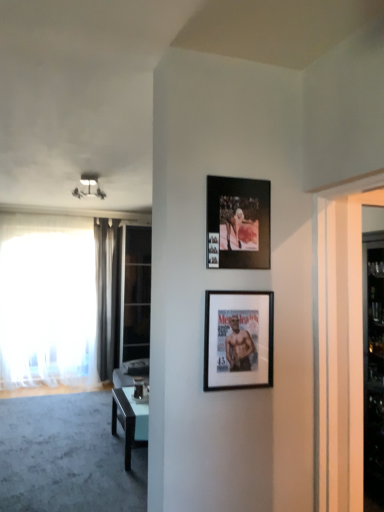
This screenshot has width=384, height=512. What do you see at coordinates (339, 351) in the screenshot? I see `white glass door at right` at bounding box center [339, 351].

Based on the photo, how much space does white sheer curtain at left, acting as the second curtain starting from the right, occupy horizontally?

white sheer curtain at left, acting as the second curtain starting from the right, is 7.44 inches wide.

The image size is (384, 512). Find the location of `black matte picture frame at center, arranged as the second picture frame when viewed from the top`. black matte picture frame at center, arranged as the second picture frame when viewed from the top is located at coordinates (238, 340).

In order to click on transparent glass door at left in this screenshot , I will do `click(135, 293)`.

Which object is thinner, white glass door at right or matte white light fixture at upper left?

With smaller width is white glass door at right.

Which point is more forward, (318, 321) or (83, 195)?

The point (318, 321) is closer to the camera.

Would you say white glass door at right is outside matte white light fixture at upper left?

That's correct, white glass door at right is outside of matte white light fixture at upper left.

Is transparent glass door at left positioned before white glass door at right?

No, it is behind white glass door at right.

From the image's perspective, relative to white glass door at right, is transparent glass door at left above or below?

Based on their image positions, transparent glass door at left is located beneath white glass door at right.

From a real-world perspective, is transparent glass door at left located higher than white glass door at right?

No, from a real-world perspective, transparent glass door at left is not over white glass door at right

Is black matte picture frame at upper center, which is the first picture frame in top-to-bottom order, looking in the opposite direction of white sheer curtain at left, the first curtain in the left-to-right sequence?

Yes.

Between black matte picture frame at upper center, which is the first picture frame in top-to-bottom order, and white sheer curtain at left, the first curtain in the left-to-right sequence, which one is positioned behind?

white sheer curtain at left, the first curtain in the left-to-right sequence, is further away from the camera.

Considering the relative positions of black matte picture frame at upper center, which is the first picture frame in top-to-bottom order, and white sheer curtain at left, the first curtain in the left-to-right sequence, in the image provided, is black matte picture frame at upper center, which is the first picture frame in top-to-bottom order, to the left or to the right of white sheer curtain at left, the first curtain in the left-to-right sequence,?

In the image, black matte picture frame at upper center, which is the first picture frame in top-to-bottom order, appears on the right side of white sheer curtain at left, the first curtain in the left-to-right sequence.

From the image's perspective, is black matte picture frame at upper center, which is the first picture frame in top-to-bottom order, located above or below white sheer curtain at left, the first curtain in the left-to-right sequence?

black matte picture frame at upper center, which is the first picture frame in top-to-bottom order, is situated higher than white sheer curtain at left, the first curtain in the left-to-right sequence, in the image.

Is black matte picture frame at upper center, which appears as the 2th picture frame when ordered from the bottom, further to camera compared to silky gray curtain at left, marked as the second curtain in a left-to-right arrangement?

That is False.

Considering the points (229, 209) and (99, 250), which point is in front, point (229, 209) or point (99, 250)?

The point (229, 209) is closer to the camera.

From the image's perspective, between black matte picture frame at upper center, which appears as the 2th picture frame when ordered from the bottom, and silky gray curtain at left, marked as the second curtain in a left-to-right arrangement, who is located below?

silky gray curtain at left, marked as the second curtain in a left-to-right arrangement, appears lower in the image.

Considering the positions of objects black matte picture frame at upper center, which appears as the 2th picture frame when ordered from the bottom, and silky gray curtain at left, which is counted as the 1th curtain, starting from the right, in the image provided, who is more to the left, black matte picture frame at upper center, which appears as the 2th picture frame when ordered from the bottom, or silky gray curtain at left, which is counted as the 1th curtain, starting from the right,?

Positioned to the left is silky gray curtain at left, which is counted as the 1th curtain, starting from the right.

Which is correct: silky gray curtain at left, which is counted as the 1th curtain, starting from the right, is inside white sheer curtain at left, the first curtain in the left-to-right sequence, or outside of it?

silky gray curtain at left, which is counted as the 1th curtain, starting from the right, is spatially situated outside white sheer curtain at left, the first curtain in the left-to-right sequence.

Considering the positions of objects silky gray curtain at left, marked as the second curtain in a left-to-right arrangement, and white sheer curtain at left, the first curtain in the left-to-right sequence, in the image provided, who is more to the left, silky gray curtain at left, marked as the second curtain in a left-to-right arrangement, or white sheer curtain at left, the first curtain in the left-to-right sequence,?

white sheer curtain at left, the first curtain in the left-to-right sequence.

Is white sheer curtain at left, the first curtain in the left-to-right sequence, at the back of silky gray curtain at left, marked as the second curtain in a left-to-right arrangement?

silky gray curtain at left, marked as the second curtain in a left-to-right arrangement, does not have its back to white sheer curtain at left, the first curtain in the left-to-right sequence.

Considering the points (107, 337) and (46, 222), which point is behind, point (107, 337) or point (46, 222)?

The point (107, 337) is more distant.

From the picture: How different are the orientations of white glass door at right and black matte picture frame at center, placed as the 1th picture frame when sorted from bottom to top, in degrees?

90 degrees.

Who is bigger, white glass door at right or black matte picture frame at center, placed as the 1th picture frame when sorted from bottom to top?

Bigger between the two is white glass door at right.

From the image's perspective, does white glass door at right appear lower than black matte picture frame at center, placed as the 1th picture frame when sorted from bottom to top?

Yes, from the image's perspective, white glass door at right is below black matte picture frame at center, placed as the 1th picture frame when sorted from bottom to top.

Looking at this image, is black matte picture frame at center, placed as the 1th picture frame when sorted from bottom to top, at the back of white glass door at right?

white glass door at right does not have its back to black matte picture frame at center, placed as the 1th picture frame when sorted from bottom to top.

In the scene shown: Considering their positions, is white sheer curtain at left, acting as the second curtain starting from the right, located in front of or behind light blue glossy table at center?

Visually, white sheer curtain at left, acting as the second curtain starting from the right, is located behind light blue glossy table at center.

Based on the photo, could you tell me if white sheer curtain at left, acting as the second curtain starting from the right, is facing light blue glossy table at center?

Yes.

From a real-world perspective, between white sheer curtain at left, the first curtain in the left-to-right sequence, and light blue glossy table at center, who is vertically higher?

white sheer curtain at left, the first curtain in the left-to-right sequence, is physically above.

This screenshot has height=512, width=384. I want to click on screen door in front of the matte white light fixture at upper left, so click(x=339, y=351).

At what (x,y) coordinates should I click in order to perform the action: click on glass door that appears on the left of white glass door at right. Please return your answer as a coordinate pair (x, y). This screenshot has height=512, width=384. Looking at the image, I should click on pyautogui.click(x=135, y=293).

Which object lies nearer to the anchor point silky gray curtain at left, marked as the second curtain in a left-to-right arrangement, transparent glass door at left or black matte picture frame at center, placed as the 1th picture frame when sorted from bottom to top?

transparent glass door at left is closer to silky gray curtain at left, marked as the second curtain in a left-to-right arrangement.

Looking at the image, which one is located closer to black matte picture frame at center, arranged as the second picture frame when viewed from the top, light blue glossy table at center or silky gray curtain at left, which is counted as the 1th curtain, starting from the right?

light blue glossy table at center.

Considering their positions, is light blue glossy table at center positioned further to silky gray curtain at left, which is counted as the 1th curtain, starting from the right, than black matte picture frame at center, arranged as the second picture frame when viewed from the top?

black matte picture frame at center, arranged as the second picture frame when viewed from the top.

When comparing their distances from white glass door at right, does black matte picture frame at upper center, which is the first picture frame in top-to-bottom order, or silky gray curtain at left, marked as the second curtain in a left-to-right arrangement, seem closer?

Among the two, black matte picture frame at upper center, which is the first picture frame in top-to-bottom order, is located nearer to white glass door at right.

Looking at the image, which one is located closer to silky gray curtain at left, which is counted as the 1th curtain, starting from the right, transparent glass door at left or matte white light fixture at upper left?

Based on the image, transparent glass door at left appears to be nearer to silky gray curtain at left, which is counted as the 1th curtain, starting from the right.

When comparing their distances from matte white light fixture at upper left, does white sheer curtain at left, the first curtain in the left-to-right sequence, or silky gray curtain at left, which is counted as the 1th curtain, starting from the right, seem closer?

silky gray curtain at left, which is counted as the 1th curtain, starting from the right.

In the scene shown: Based on their spatial positions, is black matte picture frame at upper center, which appears as the 2th picture frame when ordered from the bottom, or white sheer curtain at left, acting as the second curtain starting from the right, closer to white glass door at right?

black matte picture frame at upper center, which appears as the 2th picture frame when ordered from the bottom, is positioned closer to the anchor white glass door at right.

When comparing their distances from light blue glossy table at center, does transparent glass door at left or white sheer curtain at left, the first curtain in the left-to-right sequence, seem further?

Among the two, white sheer curtain at left, the first curtain in the left-to-right sequence, is located further to light blue glossy table at center.

You are a GUI agent. You are given a task and a screenshot of the screen. Output one action in this format:
    pyautogui.click(x=<x>, y=<y>)
    Task: Click on the light fixture between black matte picture frame at center, arranged as the second picture frame when viewed from the top, and silky gray curtain at left, marked as the second curtain in a left-to-right arrangement, from front to back
    
    Given the screenshot: What is the action you would take?
    pyautogui.click(x=89, y=187)

Identify the location of glass door located between black matte picture frame at upper center, which appears as the 2th picture frame when ordered from the bottom, and silky gray curtain at left, marked as the second curtain in a left-to-right arrangement, in the depth direction. [x=135, y=293].

Locate an element on the screen. This screenshot has height=512, width=384. light fixture between black matte picture frame at upper center, which is the first picture frame in top-to-bottom order, and transparent glass door at left from front to back is located at coordinates (89, 187).

This screenshot has height=512, width=384. Identify the location of table between white glass door at right and white sheer curtain at left, acting as the second curtain starting from the right, from front to back. [130, 421].